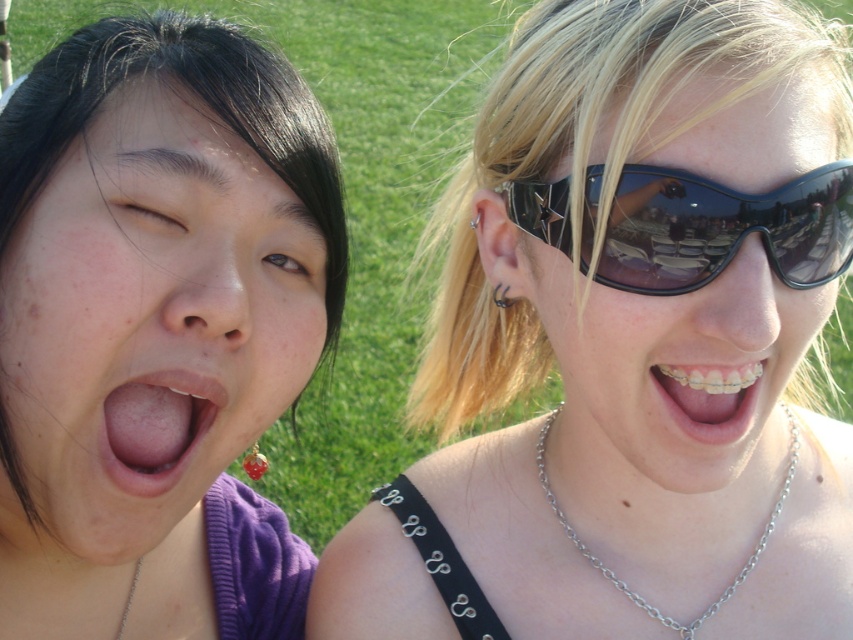
Does black shiny sunglasses at upper right appear over metallic braces at center?

Indeed, black shiny sunglasses at upper right is positioned over metallic braces at center.

Which of these two, black shiny sunglasses at upper right or metallic braces at center, stands shorter?

metallic braces at center

This screenshot has width=853, height=640. What do you see at coordinates (670, 364) in the screenshot?
I see `black shiny sunglasses at upper right` at bounding box center [670, 364].

Where is `black shiny sunglasses at upper right`? black shiny sunglasses at upper right is located at coordinates (670, 364).

Based on the photo, is pink smooth lips at lower left wider than silver chain necklace at center?

No.

Who is more forward, (122, 452) or (740, 580)?

Point (122, 452) is more forward.

Find the location of a particular element. The height and width of the screenshot is (640, 853). pink smooth lips at lower left is located at coordinates tap(155, 428).

Who is positioned more to the left, smooth skin face at left or metallic braces at center?

Positioned to the left is smooth skin face at left.

Does point (35, 452) lie in front of point (659, 385)?

Yes.

Identify the location of smooth skin face at left. This screenshot has height=640, width=853. coord(148,324).